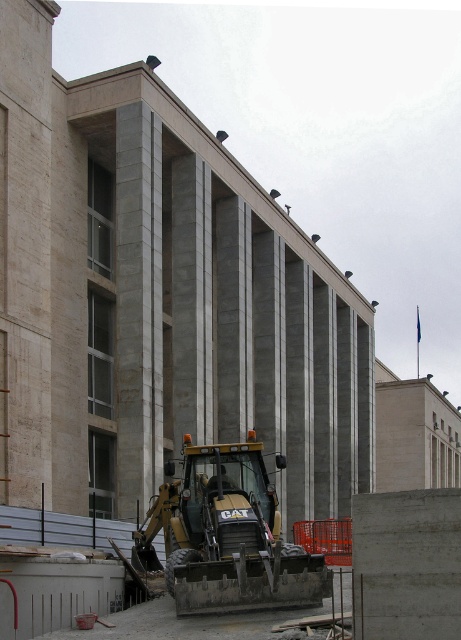
Question: Is gold metallic excavator at center smaller than metallic helmet at center?

Choices:
 (A) yes
 (B) no

Answer: (B)

Question: Which object is the closest to the concrete/plain at lower right?

Choices:
 (A) metallic helmet at center
 (B) gold metallic excavator at center

Answer: (B)

Question: Does concrete/plain at lower right have a smaller size compared to metallic helmet at center?

Choices:
 (A) no
 (B) yes

Answer: (A)

Question: Which of the following is the farthest from the observer?

Choices:
 (A) concrete/plain at lower right
 (B) gold metallic excavator at center

Answer: (B)

Question: Can you confirm if gold metallic excavator at center is positioned above concrete/plain at lower right?

Choices:
 (A) no
 (B) yes

Answer: (A)

Question: Among these objects, which one is farthest from the camera?

Choices:
 (A) gold metallic excavator at center
 (B) metallic helmet at center

Answer: (B)